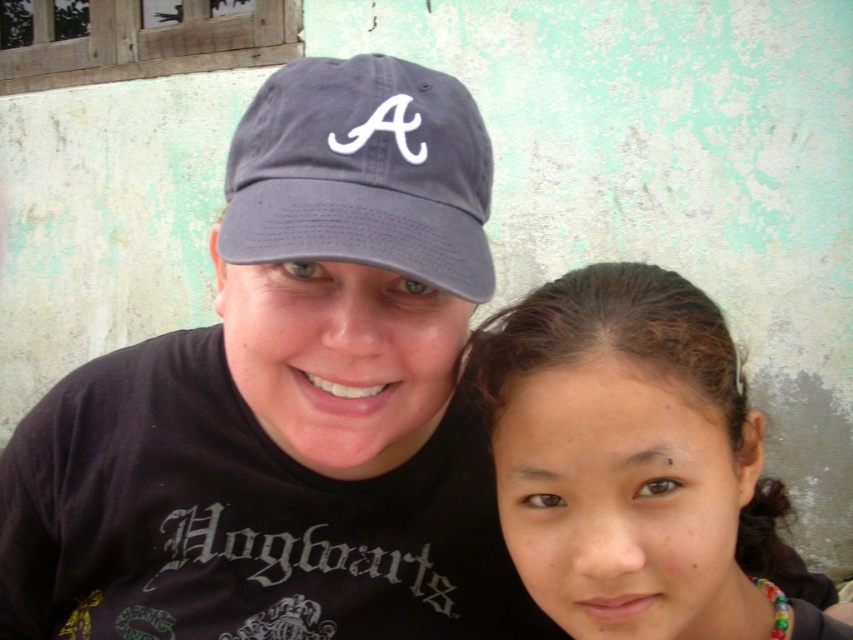
You are trying to locate the matte gray cap at upper left in the image. According to the scene description, where is it positioned relative to the two people?

The matte gray cap at upper left is located at point coordinates (289, 401).

You are a photographer trying to frame a shot of the two people in the image. You need to ensure that the matte gray cap at upper left and the dark gray fabric baseball cap at center are both visible in the frame. Given their heights, which cap should you adjust your camera angle to focus on to ensure both are in view?

The matte gray cap at upper left is much taller than the dark gray fabric baseball cap at center. To ensure both are visible, you should angle the camera downward slightly so that the taller matte gray cap at upper left remains in frame while still capturing the shorter dark gray fabric baseball cap at center.